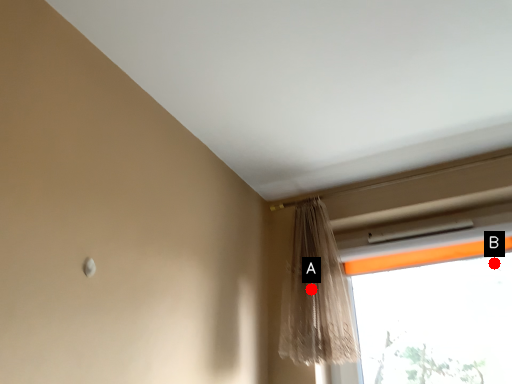
Question: Two points are circled on the image, labeled by A and B beside each circle. Which point is farther to the camera?

Choices:
 (A) A is further
 (B) B is further

Answer: (B)